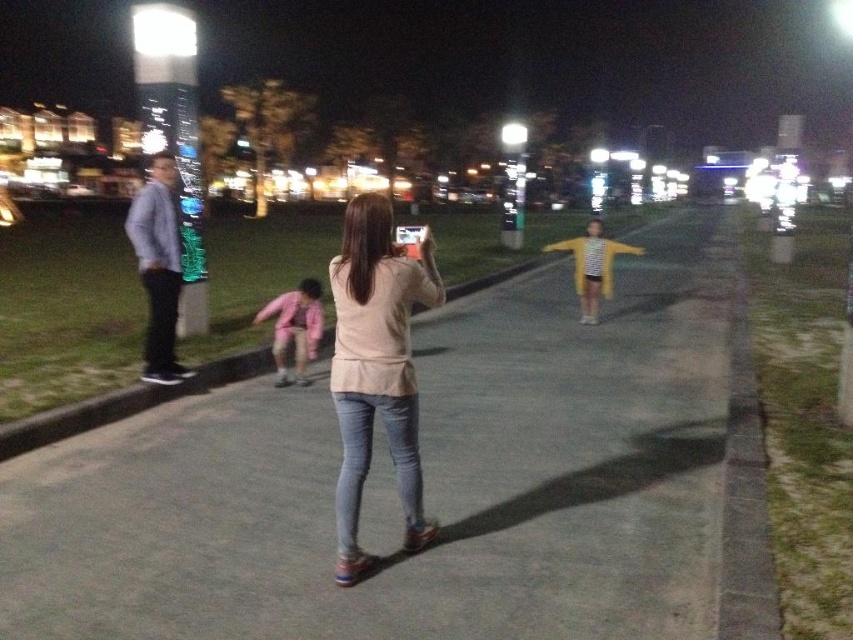
You are a pedestrian standing on the paved pathway and want to place a small backpack between the gray concrete curb at center and the pink fabric jacket at lower center. Which object should you place it closer to in order for the backpack to be closer to the viewer?

You should place the backpack closer to the gray concrete curb at center because it is already closer to the viewer than the pink fabric jacket at lower center, so placing the backpack near it will keep it nearer to your position.

You are standing at the point with coordinates point (416, 289) and want to walk towards the point with coordinates point (579, 257). Which direction should you face to move towards it?

You should face towards the upper direction because point (579, 257) is further away from the viewer compared to point (416, 289).